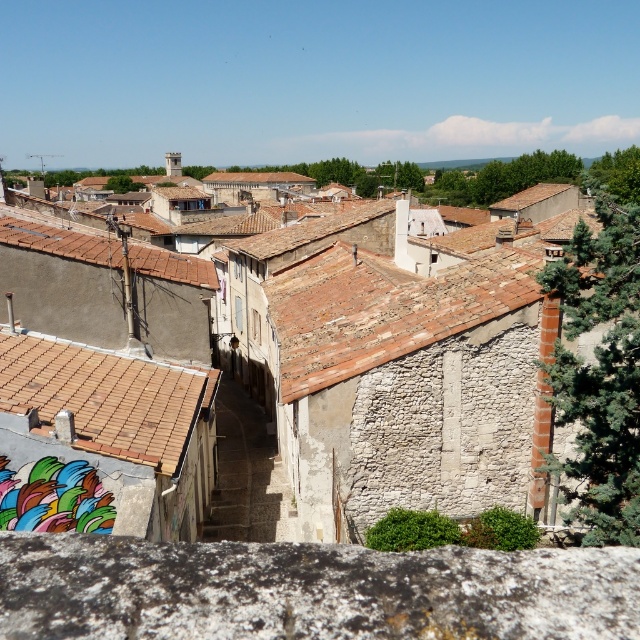
Between point (468, 304) and point (84, 253), which one is positioned behind?

Point (84, 253)

Who is positioned more to the left, rustic stone buildings at center or brown tile roof at left?

Positioned to the left is brown tile roof at left.

Measure the distance between point (x=355, y=253) and camera.

92.63 feet

In order to click on rustic stone buildings at center in this screenshot , I will do `click(397, 362)`.

Based on the photo, does rustic stone buildings at center appear under brown tiled roof at lower left?

Actually, rustic stone buildings at center is above brown tiled roof at lower left.

Can you confirm if rustic stone buildings at center is positioned above brown tiled roof at lower left?

Yes, rustic stone buildings at center is above brown tiled roof at lower left.

What do you see at coordinates (397, 362) in the screenshot?
I see `rustic stone buildings at center` at bounding box center [397, 362].

I want to click on rustic stone buildings at center, so click(397, 362).

Does brown tiled roof at lower left have a greater height compared to brown tile roof at left?

Yes.

Between brown tiled roof at lower left and brown tile roof at left, which one appears on the left side from the viewer's perspective?

brown tile roof at left is more to the left.

Measure the distance between brown tiled roof at lower left and camera.

brown tiled roof at lower left is 13.03 meters from camera.

Locate an element on the screen. The height and width of the screenshot is (640, 640). brown tiled roof at lower left is located at coordinates (106, 396).